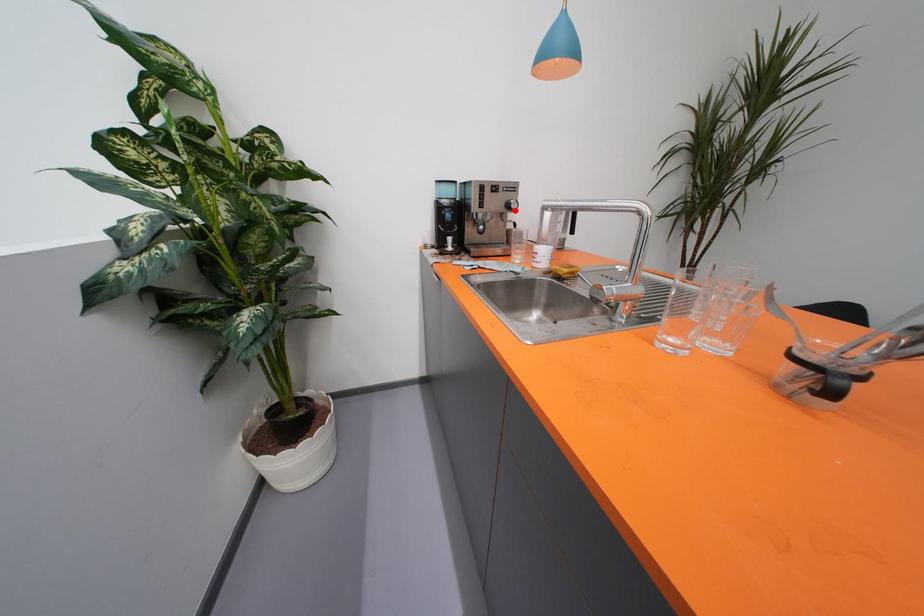
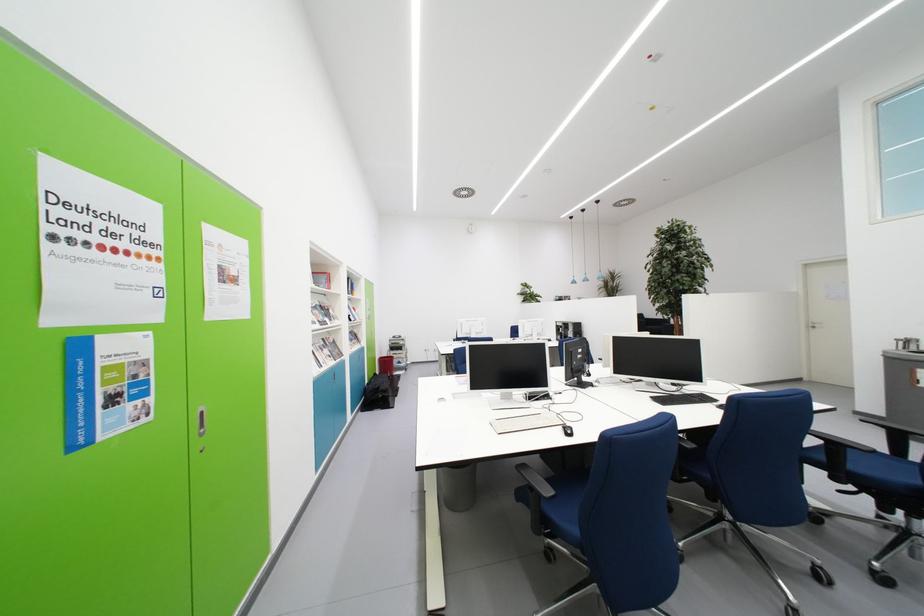
Question: I am providing you with two images of the same scene from different viewpoints. A red point is marked on the first image. At the location where the point appears in image 1, is it still visible in image 2?

Choices:
 (A) Yes
 (B) No

Answer: (B)